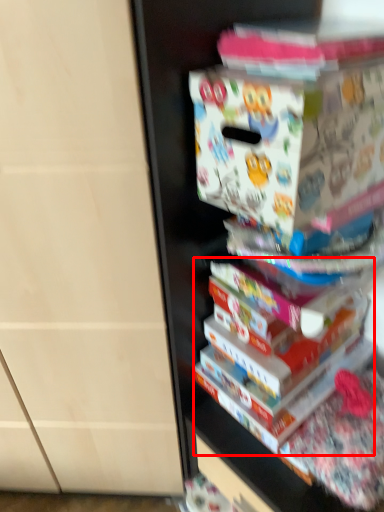
Question: From the image's perspective, what is the correct spatial positioning of book (annotated by the red box) in reference to paperback book?

Choices:
 (A) below
 (B) above

Answer: (A)